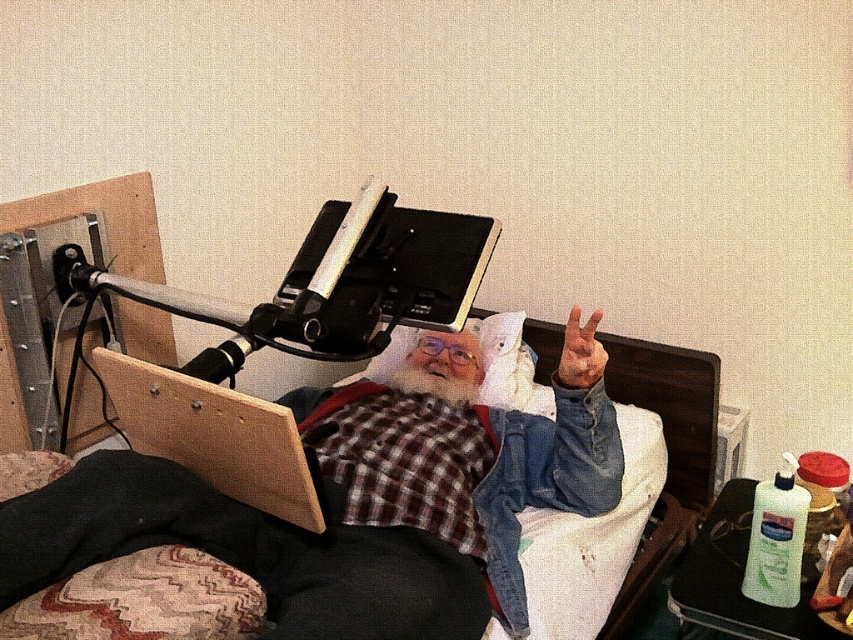
Is denim bed at center closer to camera compared to wooden board at lower left?

Yes, denim bed at center is closer to the viewer.

Can you confirm if denim bed at center is wider than wooden board at lower left?

Yes.

This screenshot has width=853, height=640. I want to click on denim bed at center, so click(x=231, y=547).

Identify the location of wooden board at lower left. This screenshot has width=853, height=640. (213, 435).

From the picture: Is wooden board at lower left closer to camera compared to brown leather hand at upper right?

That is True.

Which is in front, point (142, 438) or point (581, 346)?

Point (142, 438) is in front.

Where is `wooden board at lower left`? Image resolution: width=853 pixels, height=640 pixels. wooden board at lower left is located at coordinates [x=213, y=435].

Who is taller, denim bed at center or brown leather hand at upper right?

denim bed at center

The width and height of the screenshot is (853, 640). What are the coordinates of `denim bed at center` in the screenshot? It's located at (231, 547).

This screenshot has width=853, height=640. In order to click on denim bed at center in this screenshot , I will do `click(231, 547)`.